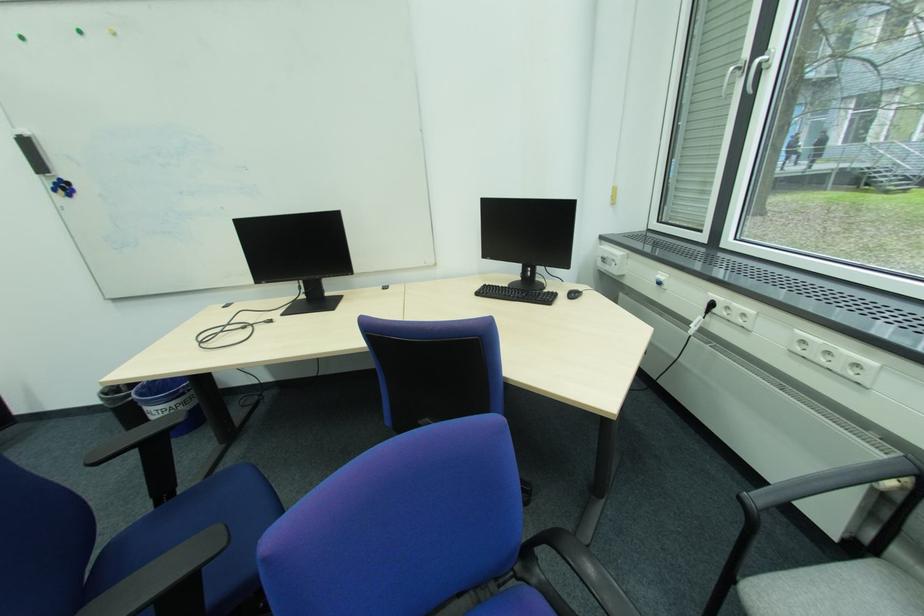
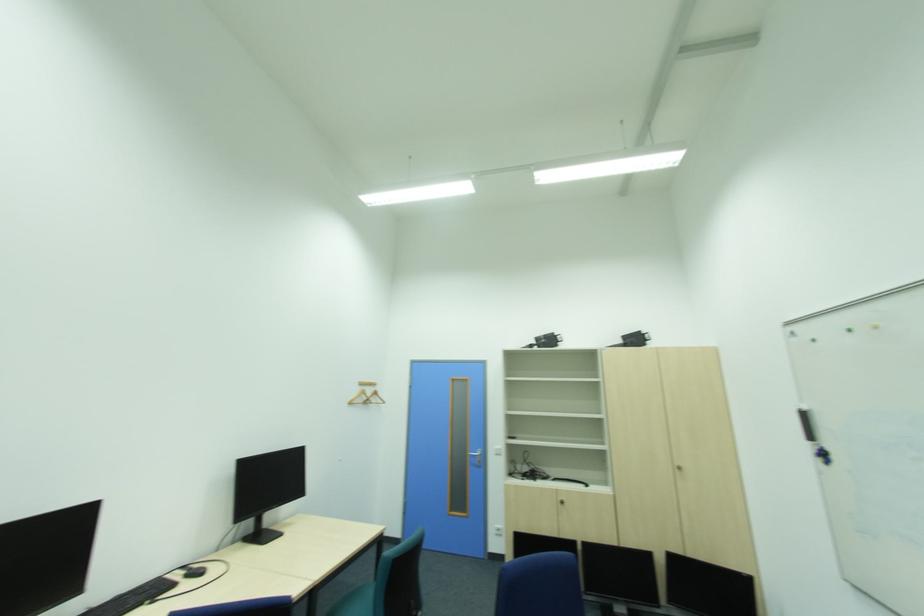
Question: The camera is either moving clockwise (left) or counter-clockwise (right) around the object. The first image is from the beginning of the video and the second image is from the end. Is the camera moving left or right when shooting the video?

Choices:
 (A) Left
 (B) Right

Answer: (B)